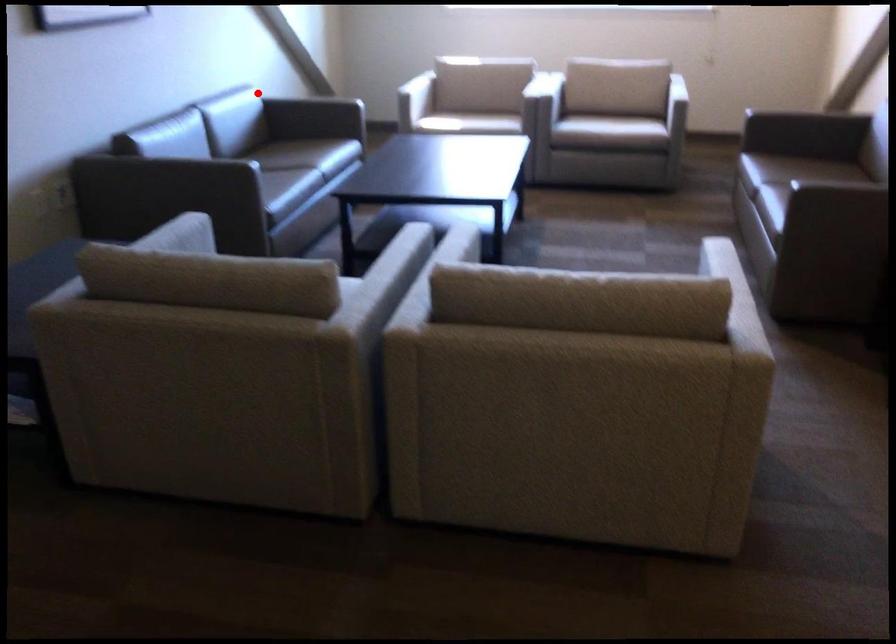
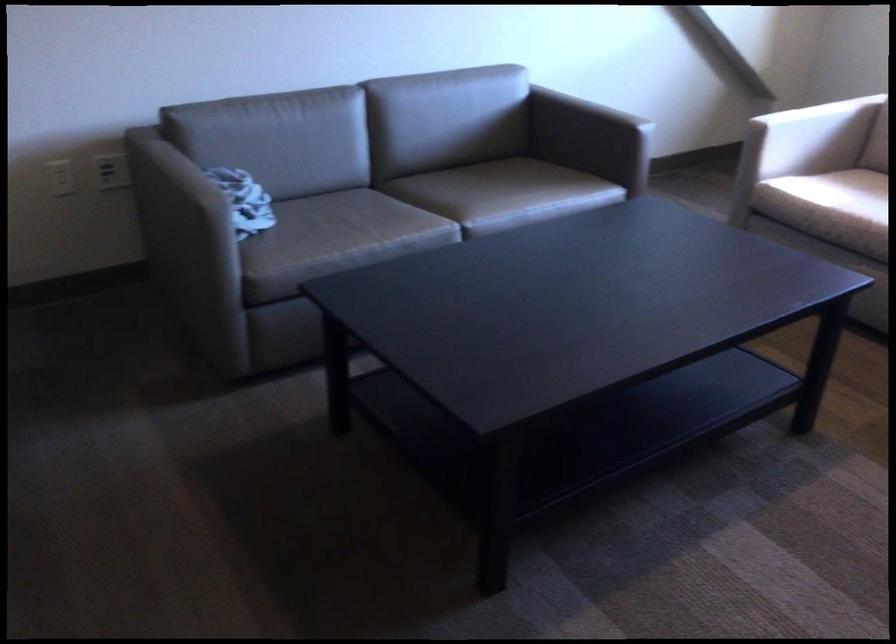
Question: A red point is marked in image1. In image2, is the corresponding 3D point closer to the camera or farther? Reply with the corresponding letter.

Choices:
 (A) The corresponding 3D point is closer.
 (B) The corresponding 3D point is farther.

Answer: (A)